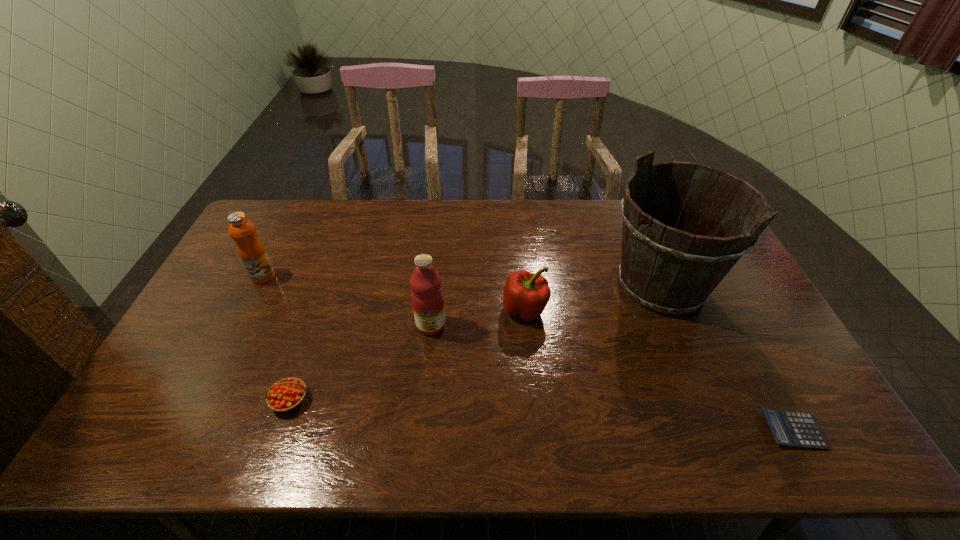
This screenshot has height=540, width=960. Find the location of `object at the near right corner`. object at the near right corner is located at coordinates (790, 428).

In the image, there is a desktop. Where is `free space at the far edge`? This screenshot has width=960, height=540. free space at the far edge is located at coordinates (349, 220).

Where is `vacant area at the near edge of the desktop`? vacant area at the near edge of the desktop is located at coordinates pos(354,451).

Identify the location of free location at the left edge. This screenshot has width=960, height=540. (199, 319).

What are the coordinates of `free location at the right edge of the desktop` in the screenshot? It's located at (761, 358).

At what (x,y) coordinates should I click in order to perform the action: click on vacant area that lies between the second shortest object and the fourth object from right to left. Please return your answer as a coordinate pair (x, y). Looking at the image, I should click on (360, 362).

The width and height of the screenshot is (960, 540). In order to click on vacant point located between the strawberry and the tallest object in this screenshot , I will do `click(475, 343)`.

Find the location of `free spot between the calculator and the tallest object`. free spot between the calculator and the tallest object is located at coordinates (727, 358).

Image resolution: width=960 pixels, height=540 pixels. I want to click on unoccupied area between the bell pepper and the calculator, so click(659, 370).

The height and width of the screenshot is (540, 960). Identify the location of vacant region between the shortest object and the fourth object from right to left. 612,377.